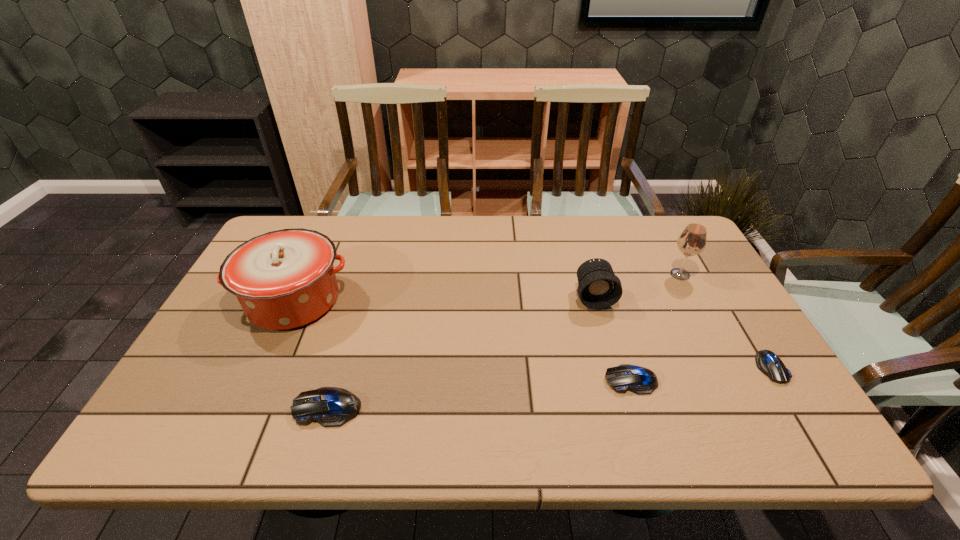
The width and height of the screenshot is (960, 540). In order to click on the closest computer mouse relative to the casserole in this screenshot , I will do `click(329, 406)`.

In order to click on the second closest computer mouse to the third shortest object in this screenshot , I will do `click(767, 362)`.

Identify the location of vacant position in the image that satisfies the following two spatial constraints: 1. at the front element of the telephoto lens; 2. on the button side of the leftmost computer mouse. This screenshot has width=960, height=540. (625, 408).

Identify the location of vacant area in the image that satisfies the following two spatial constraints: 1. on the button side of the rightmost object; 2. on the button side of the fifth tallest object. This screenshot has height=540, width=960. (779, 380).

Locate an element on the screen. blank area in the image that satisfies the following two spatial constraints: 1. on the button side of the shortest computer mouse; 2. on the button side of the leftmost computer mouse is located at coordinates (795, 408).

Identify the location of vacant space that satisfies the following two spatial constraints: 1. at the front element of the telephoto lens; 2. on the button side of the tallest computer mouse. (625, 408).